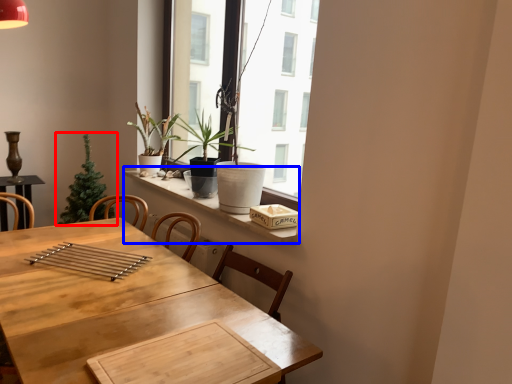
Question: Which object is further to the camera taking this photo, houseplant (highlighted by a red box) or window sill (highlighted by a blue box)?

Choices:
 (A) houseplant
 (B) window sill

Answer: (A)